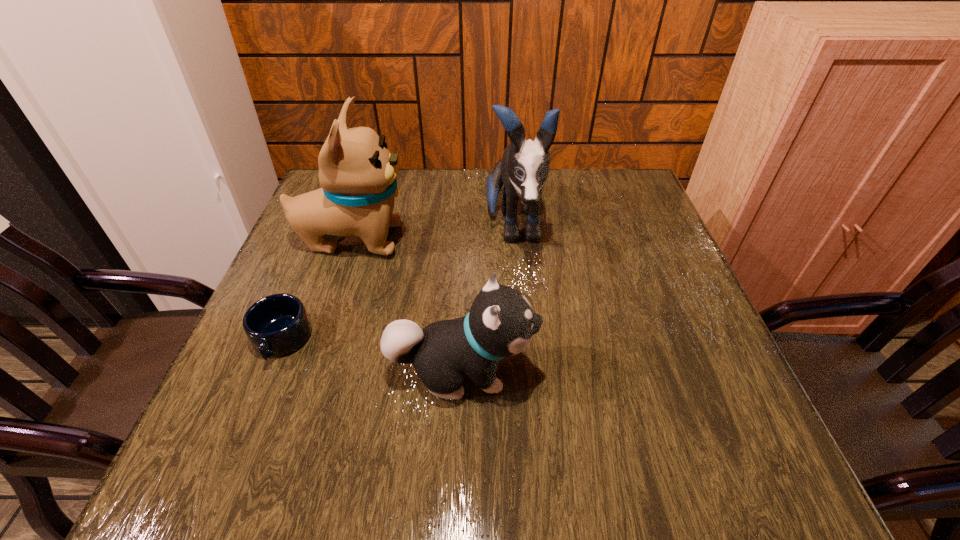
At what (x,y) coordinates should I click in order to perform the action: click on the leftmost puppy. Please return your answer as a coordinate pair (x, y). Image resolution: width=960 pixels, height=540 pixels. Looking at the image, I should click on (357, 173).

Identify the location of the nearest puppy. The width and height of the screenshot is (960, 540). (501, 323).

The image size is (960, 540). What are the coordinates of `the second shortest object` in the screenshot? It's located at (501, 323).

This screenshot has width=960, height=540. Find the location of `the shortest object`. the shortest object is located at coordinates (276, 325).

What are the coordinates of `vacant space situated on the face of the leftmost puppy` in the screenshot? It's located at (507, 240).

Find the location of a particular element. This screenshot has height=540, width=960. vacant space located at the face of the shortest puppy is located at coordinates (688, 371).

Locate an element on the screen. The image size is (960, 540). vacant space located with the handle on the side of the mug is located at coordinates (230, 467).

This screenshot has height=540, width=960. I want to click on object located in the far edge section of the desktop, so tap(524, 167).

Image resolution: width=960 pixels, height=540 pixels. In order to click on puppy that is positioned at the left edge in this screenshot , I will do point(357,173).

This screenshot has height=540, width=960. What are the coordinates of `mug that is positioned at the left edge` in the screenshot? It's located at (276, 325).